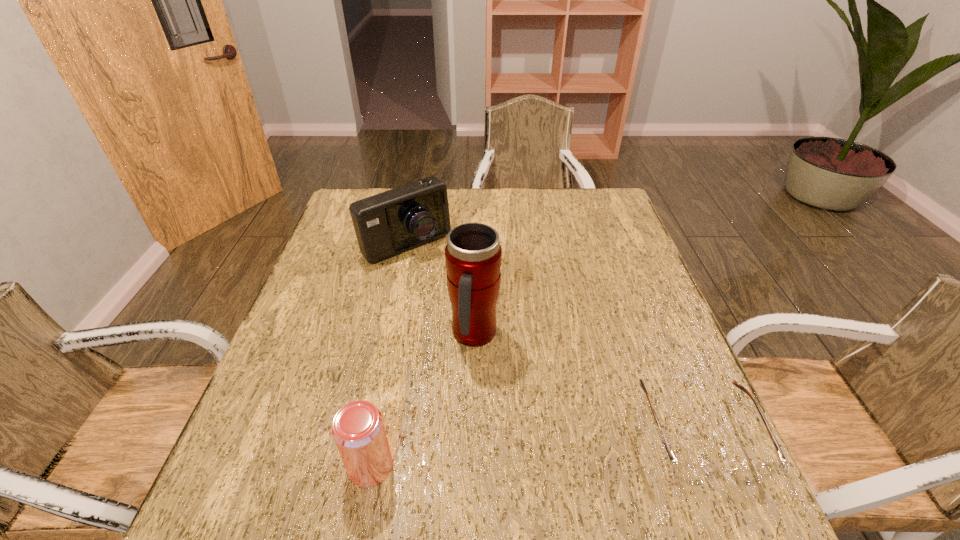
You are a GUI agent. You are given a task and a screenshot of the screen. Output one action in this format:
    pyautogui.click(x=<x>, y=<y>)
    Task: Click on the free space on the desktop that is between the third tallest object and the spectacles and is positioned on the front-facing side of the camera
    Image resolution: width=960 pixels, height=540 pixels.
    Given the screenshot: What is the action you would take?
    pyautogui.click(x=577, y=446)

You are a GUI agent. You are given a task and a screenshot of the screen. Output one action in this format:
    pyautogui.click(x=<x>, y=<y>)
    Task: Click on the free space on the desktop that is between the second shortest object and the spectacles and is positioned on the side with the handle of the thermos bottle
    Image resolution: width=960 pixels, height=540 pixels.
    Given the screenshot: What is the action you would take?
    pyautogui.click(x=560, y=447)